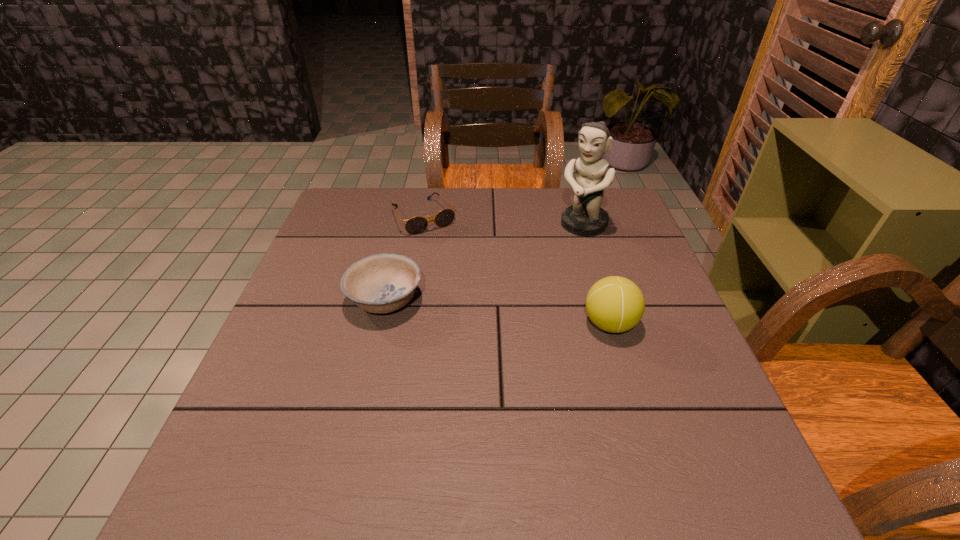
Identify the location of the third tallest object. The width and height of the screenshot is (960, 540). (x=381, y=283).

The image size is (960, 540). Identify the location of the third shortest object. pyautogui.click(x=615, y=304).

The height and width of the screenshot is (540, 960). I want to click on sunglasses, so click(416, 225).

What are the coordinates of `the tallest object` in the screenshot? It's located at (585, 217).

In order to click on vacant area situated 0.140m on the right of the bowl in this screenshot , I will do `click(483, 300)`.

Where is `vacant region located 0.230m on the left of the tennis ball`? This screenshot has height=540, width=960. vacant region located 0.230m on the left of the tennis ball is located at coordinates (478, 324).

You are a GUI agent. You are given a task and a screenshot of the screen. Output one action in this format:
    pyautogui.click(x=<x>, y=<y>)
    Task: Click on the vacant region located 0.240m on the lenses of the shortest object
    The width and height of the screenshot is (960, 540).
    Given the screenshot: What is the action you would take?
    pyautogui.click(x=472, y=286)

You are a GUI agent. You are given a task and a screenshot of the screen. Output one action in this format:
    pyautogui.click(x=<x>, y=<y>)
    Task: Click on the free space located 0.130m on the lenses of the shortest object
    The height and width of the screenshot is (540, 960).
    Given the screenshot: What is the action you would take?
    pyautogui.click(x=454, y=261)

Locate an element on the screen. The height and width of the screenshot is (540, 960). vacant position located 0.070m on the lenses of the shortest object is located at coordinates (445, 248).

Identify the location of vacant area situated 0.050m on the front-facing side of the tallest object. This screenshot has height=540, width=960. (562, 244).